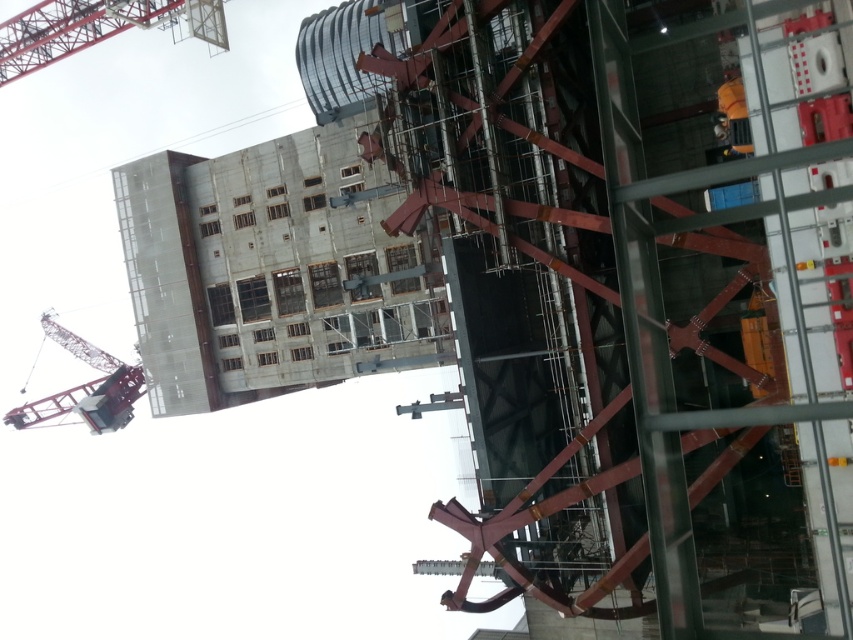
Does concrete/rough at center have a lesser height compared to metallic gray crane at upper left?

Incorrect, concrete/rough at center's height does not fall short of metallic gray crane at upper left's.

Is concrete/rough at center further to the viewer compared to metallic gray crane at upper left?

No, concrete/rough at center is in front of metallic gray crane at upper left.

Locate an element on the screen. This screenshot has height=640, width=853. concrete/rough at center is located at coordinates (271, 272).

At what (x,y) coordinates should I click in order to perform the action: click on concrete/rough at center. Please return your answer as a coordinate pair (x, y). Looking at the image, I should click on (271, 272).

In the scene shown: Is metallic scaffolding at upper left in front of metallic gray crane at upper left?

That is True.

Between metallic scaffolding at upper left and metallic gray crane at upper left, which one appears on the left side from the viewer's perspective?

Positioned to the left is metallic gray crane at upper left.

The image size is (853, 640). What do you see at coordinates (96, 28) in the screenshot?
I see `metallic scaffolding at upper left` at bounding box center [96, 28].

In order to click on metallic scaffolding at upper left in this screenshot , I will do `click(96, 28)`.

Is concrete/rough at center to the left of metallic scaffolding at upper left from the viewer's perspective?

No, concrete/rough at center is not to the left of metallic scaffolding at upper left.

Is point (252, 163) positioned in front of point (218, 8)?

Yes, it is.

Is point (152, 384) behind point (15, 49)?

No, it is not.

This screenshot has height=640, width=853. I want to click on concrete/rough at center, so click(271, 272).